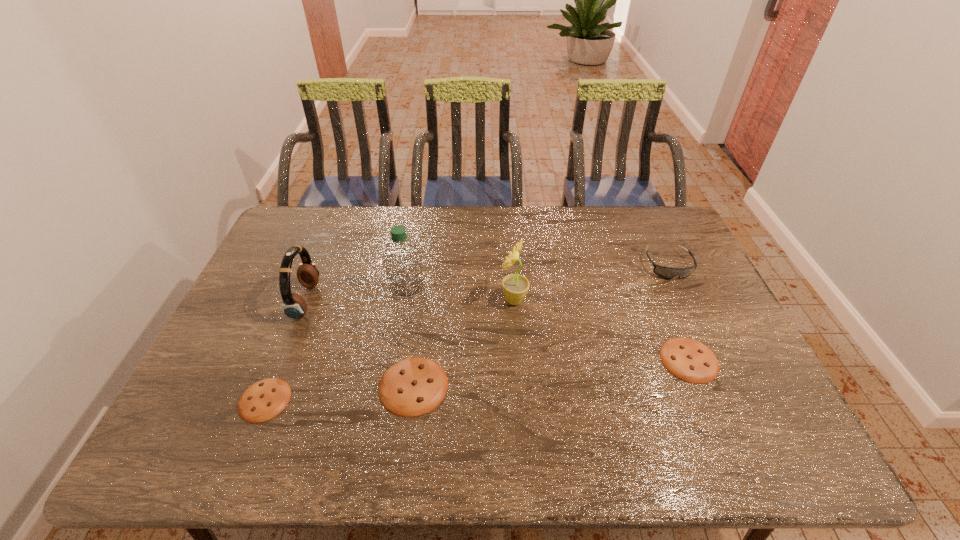
This screenshot has height=540, width=960. Identify the location of free space between the water bottle and the fifth shortest object. (356, 294).

Where is `empty location between the leftmost cookie and the sunflower`? empty location between the leftmost cookie and the sunflower is located at coordinates (389, 350).

This screenshot has width=960, height=540. In order to click on blank region between the sunflower and the fourth tallest object in this screenshot , I will do `click(590, 282)`.

The height and width of the screenshot is (540, 960). I want to click on free space between the second cookie from left to right and the water bottle, so click(410, 336).

Identify the location of free space between the second cookie from right to left and the shortest cookie. (339, 393).

Image resolution: width=960 pixels, height=540 pixels. In order to click on empty space that is in between the goggles and the shortest object in this screenshot , I will do `click(467, 333)`.

Where is `vacant space in between the third tallest object and the fourth shortest object`? vacant space in between the third tallest object and the fourth shortest object is located at coordinates (487, 283).

Identify the location of free space between the rightmost cookie and the water bottle. (548, 323).

Locate an element on the screen. The height and width of the screenshot is (540, 960). the closest object relative to the water bottle is located at coordinates (294, 306).

What are the coordinates of `object that is the second closest one to the headset` in the screenshot? It's located at (402, 259).